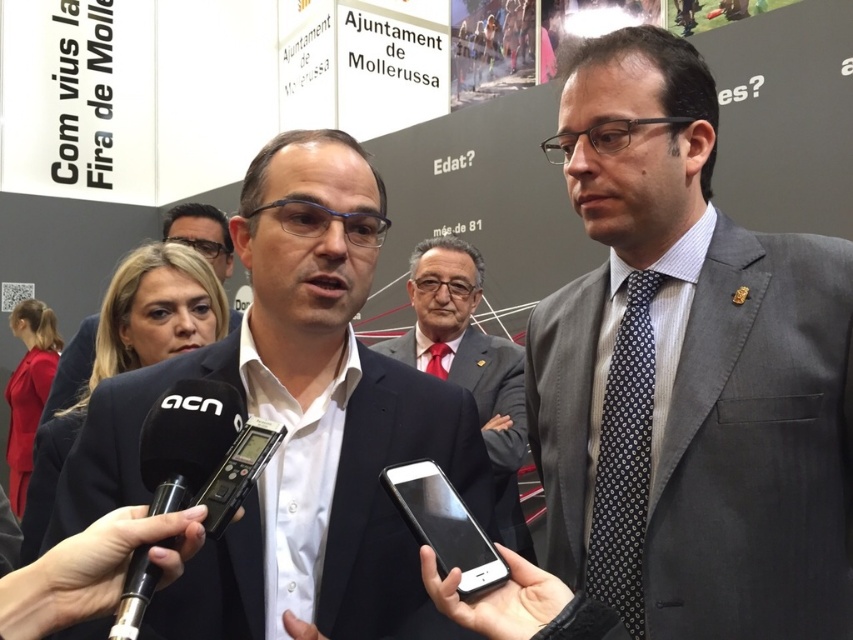
You are a photographer at the press conference. You need to take a photo that includes both the gray wool suit at right and the white shirt at center. Based on their positions, which one should you focus on first to ensure both are in the frame?

The gray wool suit at right is positioned on the right side of white shirt at center. To include both in the frame, focus on the white shirt at center first as it is centrally located, then adjust to include the gray wool suit at right.